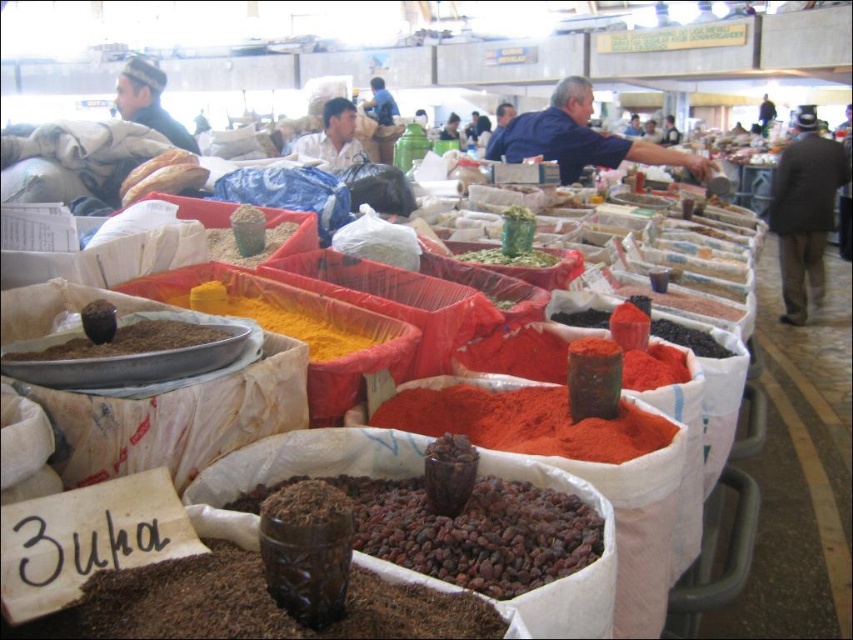
Question: Is dark red powder at center to the right of yellow powder at center from the viewer's perspective?

Choices:
 (A) yes
 (B) no

Answer: (A)

Question: Which object is positioned farthest from the green leafy at center?

Choices:
 (A) dark brown textured seeds at center
 (B) dark red powder at center

Answer: (A)

Question: Which object is the closest to the yellow powder at center?

Choices:
 (A) green leafy at center
 (B) dark red powder at center
 (C) brown matte spice at center
 (D) dark brown textured seeds at center

Answer: (A)

Question: Can you confirm if dark brown textured seeds at center is positioned to the left of yellow powder at center?

Choices:
 (A) no
 (B) yes

Answer: (A)

Question: Does bright orange powder at center come behind dark red powder at center?

Choices:
 (A) yes
 (B) no

Answer: (B)

Question: Which is nearer to the green leafy at center?

Choices:
 (A) yellow powder at center
 (B) dark red powder at center

Answer: (B)